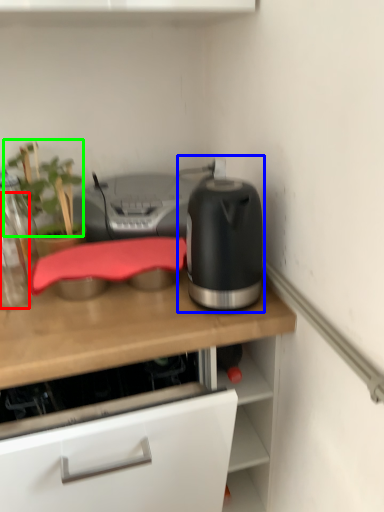
Question: Which is nearer to the bottle (highlighted by a red box)? kitchen appliance (highlighted by a blue box) or plant (highlighted by a green box).

Choices:
 (A) kitchen appliance
 (B) plant

Answer: (B)